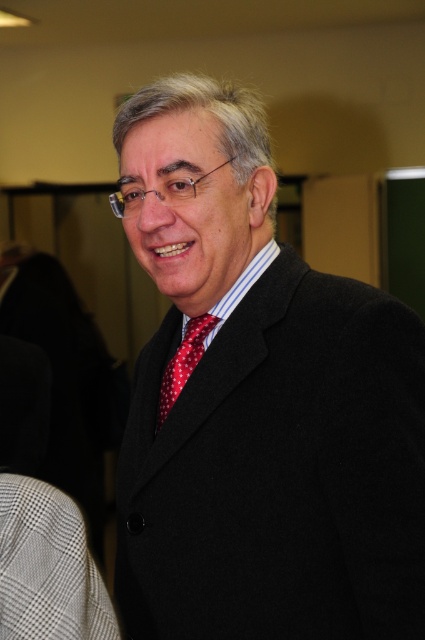
You are a photographer preparing to take a portrait of the man in the image. You need to focus on either the matte black suit at center or the red dotted tie at center. Which object should you focus on to ensure it appears larger in the photo?

The matte black suit at center is closer to the viewer than the red dotted tie at center, so focusing on it will make it appear larger in the photo.

You are standing in the conference room and want to move from the point at coordinates point (261,202) to the point at coordinates point (214,316). Which direction should you move in to reach your destination?

To move from point (261,202) to point (214,316), you should move towards the right and slightly downward since point (214,316) is located to the right and below point (261,202).